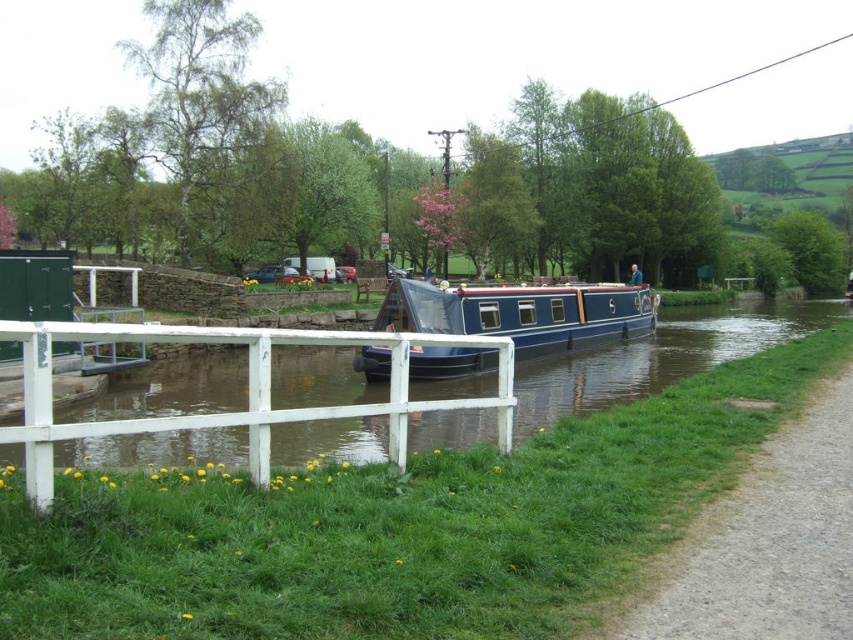
Question: Is white wooden fence at lower left closer to camera compared to gravel path at lower right?

Choices:
 (A) no
 (B) yes

Answer: (B)

Question: Can you confirm if white wooden fence at lower left is wider than blue polished wood barge at center?

Choices:
 (A) yes
 (B) no

Answer: (A)

Question: Based on their relative distances, which object is nearer to the blue polished wood barge at center?

Choices:
 (A) gravel path at lower right
 (B) white wooden fence at lower left

Answer: (B)

Question: Among these objects, which one is nearest to the camera?

Choices:
 (A) gravel path at lower right
 (B) white wooden fence at lower left
 (C) blue polished wood barge at center

Answer: (B)

Question: Is white wooden fence at lower left to the left of blue polished wood barge at center from the viewer's perspective?

Choices:
 (A) yes
 (B) no

Answer: (B)

Question: Among these objects, which one is nearest to the camera?

Choices:
 (A) white wooden fence at lower left
 (B) blue polished wood barge at center

Answer: (A)